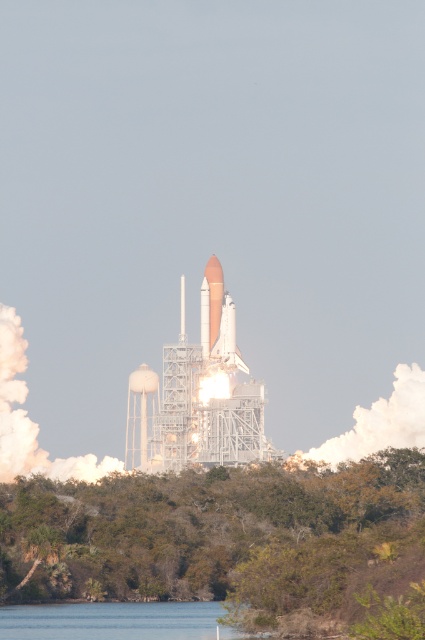
You are a photographer standing at the launch site. You want to capture a photo where both the clear water at lower center and the matte white shuttle at center are visible. Based on their heights, which object will appear closer to the bottom of the photo?

The clear water at lower center has a lesser height compared to the matte white shuttle at center, so it will appear closer to the bottom of the photo.

You are a photographer trying to capture the space shuttle launch. You notice the clear water at lower center and the matte white shuttle at center in your viewfinder. Which object in your frame takes up more visual space?

The clear water at lower center takes up more visual space as it is larger in size than the matte white shuttle at center.